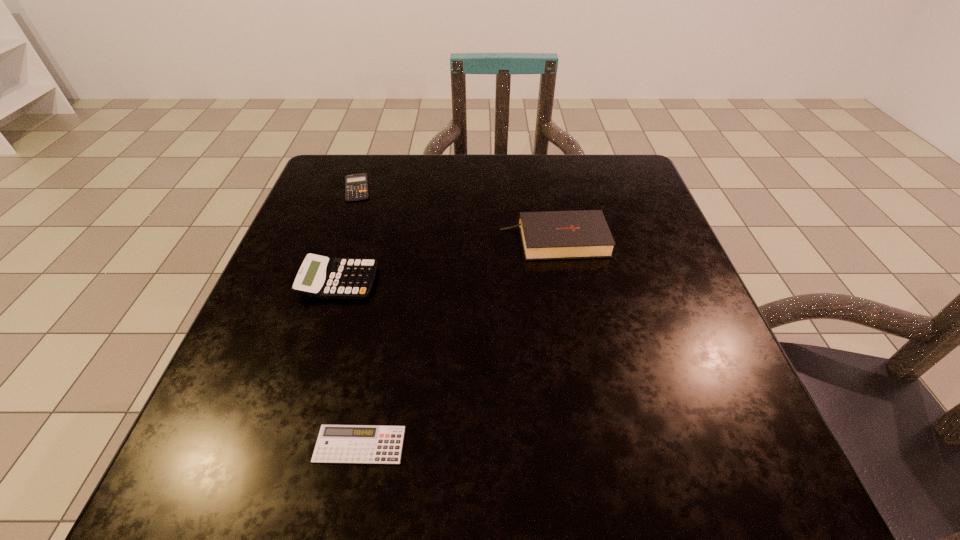
Find the location of a particular element. vacant space at the near left corner of the desktop is located at coordinates [x=199, y=450].

In the image, there is a desktop. At what (x,y) coordinates should I click in order to perform the action: click on vacant region at the far right corner. Please return your answer as a coordinate pair (x, y). Looking at the image, I should click on (614, 193).

Identify the location of blank space at the near right corner. (780, 467).

Locate an element on the screen. vacant area that lies between the third tallest object and the second tallest object is located at coordinates click(x=348, y=235).

Find the location of `free point between the second farthest object and the second nearest object`. free point between the second farthest object and the second nearest object is located at coordinates (446, 261).

The height and width of the screenshot is (540, 960). In order to click on free space that is in between the nearest object and the farthest object in this screenshot , I will do `click(358, 316)`.

The image size is (960, 540). What are the coordinates of `blank region between the tallest object and the nearest calculator` in the screenshot? It's located at (457, 342).

This screenshot has height=540, width=960. I want to click on empty space between the tallest calculator and the farthest calculator, so click(x=348, y=235).

The width and height of the screenshot is (960, 540). I want to click on free area in between the shortest calculator and the Bible, so click(x=457, y=342).

Find the location of a particular element. vacant area that lies between the second nearest object and the second tallest calculator is located at coordinates (348, 235).